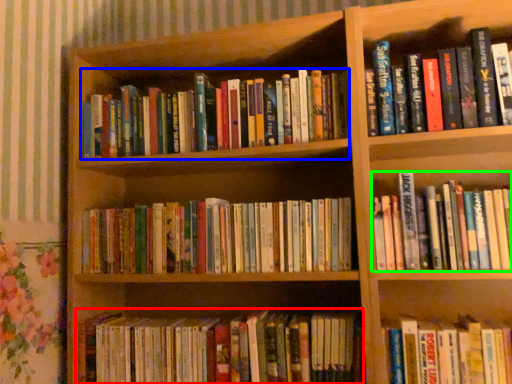
Question: Based on their relative distances, which object is farther from book (highlighted by a red box)? Choose from book (highlighted by a blue box) and book (highlighted by a green box).

Choices:
 (A) book
 (B) book

Answer: (A)